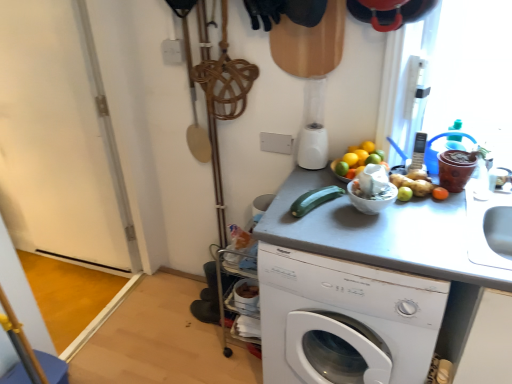
Question: Considering the relative sizes of white plastic washing machine at center and white glossy bowl at upper right in the image provided, is white plastic washing machine at center wider than white glossy bowl at upper right?

Choices:
 (A) no
 (B) yes

Answer: (B)

Question: Does white plastic washing machine at center appear on the left side of white glossy bowl at upper right?

Choices:
 (A) no
 (B) yes

Answer: (A)

Question: Can you confirm if white plastic washing machine at center is bigger than white glossy bowl at upper right?

Choices:
 (A) no
 (B) yes

Answer: (B)

Question: Would you say white plastic washing machine at center contains white glossy bowl at upper right?

Choices:
 (A) yes
 (B) no

Answer: (B)

Question: Could you tell me if white plastic washing machine at center is turned towards white glossy bowl at upper right?

Choices:
 (A) yes
 (B) no

Answer: (B)

Question: Can you confirm if white plastic washing machine at center is positioned to the right of white glossy bowl at upper right?

Choices:
 (A) no
 (B) yes

Answer: (B)

Question: From a real-world perspective, is silver metallic phone at upper right over gray matte counter top at center?

Choices:
 (A) no
 (B) yes

Answer: (B)

Question: From the image's perspective, is silver metallic phone at upper right below gray matte counter top at center?

Choices:
 (A) yes
 (B) no

Answer: (B)

Question: Is the depth of silver metallic phone at upper right less than that of gray matte counter top at center?

Choices:
 (A) yes
 (B) no

Answer: (B)

Question: Is silver metallic phone at upper right shorter than gray matte counter top at center?

Choices:
 (A) yes
 (B) no

Answer: (A)

Question: Can you confirm if silver metallic phone at upper right is thinner than gray matte counter top at center?

Choices:
 (A) yes
 (B) no

Answer: (A)

Question: Considering the relative positions of silver metallic phone at upper right and gray matte counter top at center in the image provided, is silver metallic phone at upper right behind gray matte counter top at center?

Choices:
 (A) yes
 (B) no

Answer: (A)

Question: Considering the relative positions of white glossy bowl at upper right and white plastic washing machine at center in the image provided, is white glossy bowl at upper right to the right of white plastic washing machine at center from the viewer's perspective?

Choices:
 (A) no
 (B) yes

Answer: (A)